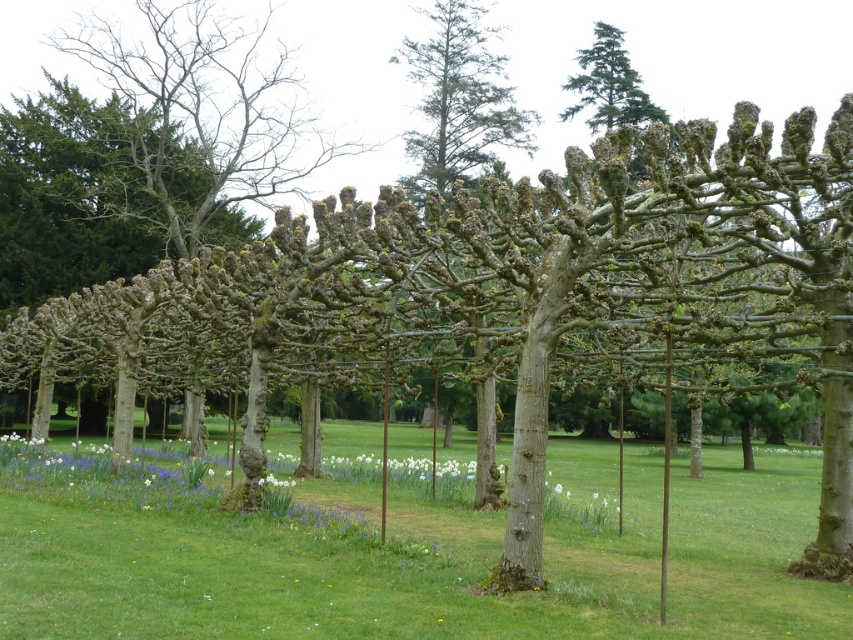
Who is positioned more to the left, green grass at center or white matte flower at center?

From the viewer's perspective, white matte flower at center appears more on the left side.

Identify the location of green grass at center. Image resolution: width=853 pixels, height=640 pixels. (437, 563).

Identify the location of green grass at center. (437, 563).